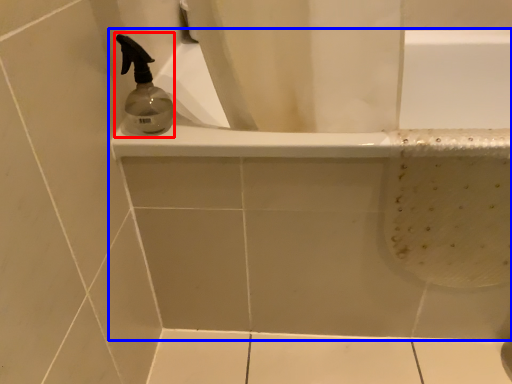
Question: Which object is further to the camera taking this photo, soap dispenser (highlighted by a red box) or bathtub (highlighted by a blue box)?

Choices:
 (A) soap dispenser
 (B) bathtub

Answer: (B)